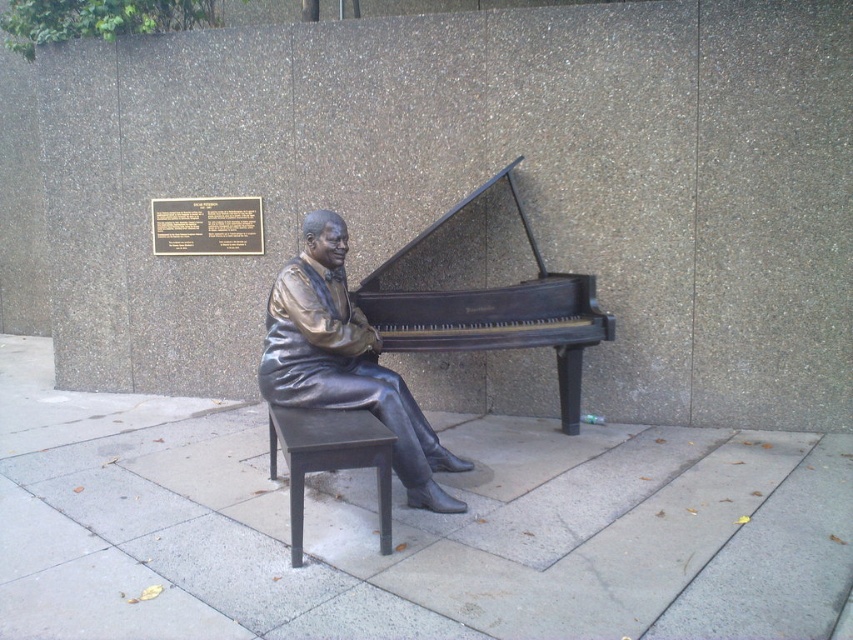
You are standing in front of the bronze statue of the seated man playing the grand piano. There are two points marked on the statue. The first point is at coordinate point (410, 464) and the second point is at coordinate point (488, 337). Which of these two points is closer to you?

Point (410, 464) is closer to the viewer than point (488, 337).

You are a maintenance worker needing to clean the bronze statue at center and the bronze polished piano at center. Your cleaning tool has a maximum reach of 30 inches. Can you clean both objects without moving your position?

The distance between the bronze statue at center and the bronze polished piano at center is 31.74 inches. Since your tool only reaches 30 inches, you cannot clean both objects without moving your position.

You are a city planner reviewing the layout of a public square. You need to determine if the gray concrete pavement at center can accommodate a temporary event setup that requires more space than the bronze polished piano at center. Based on the scene description, can the pavement area be used for this purpose?

The gray concrete pavement at center is smaller than the bronze polished piano at center. Since the event setup requires more space than the piano, the pavement area is insufficient and cannot be used for this purpose.